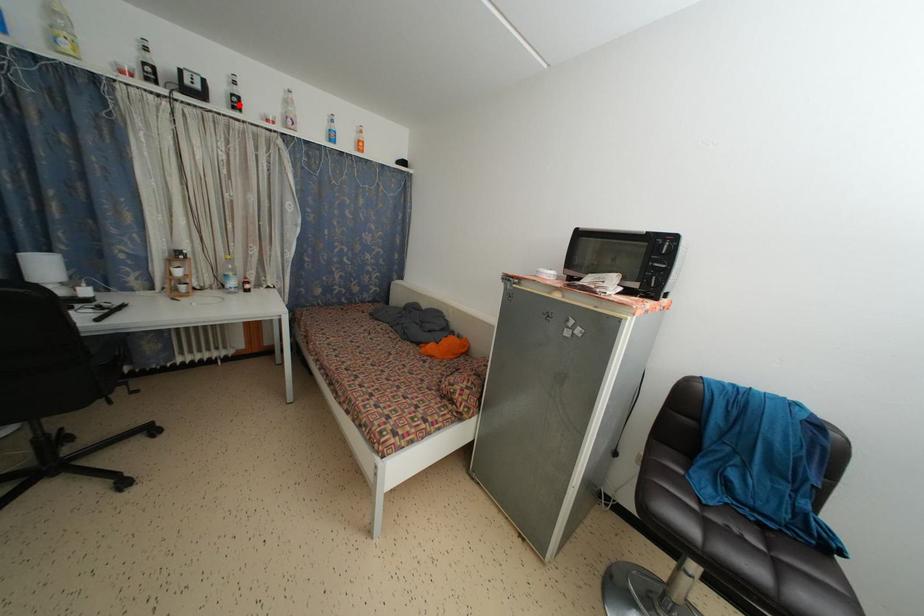
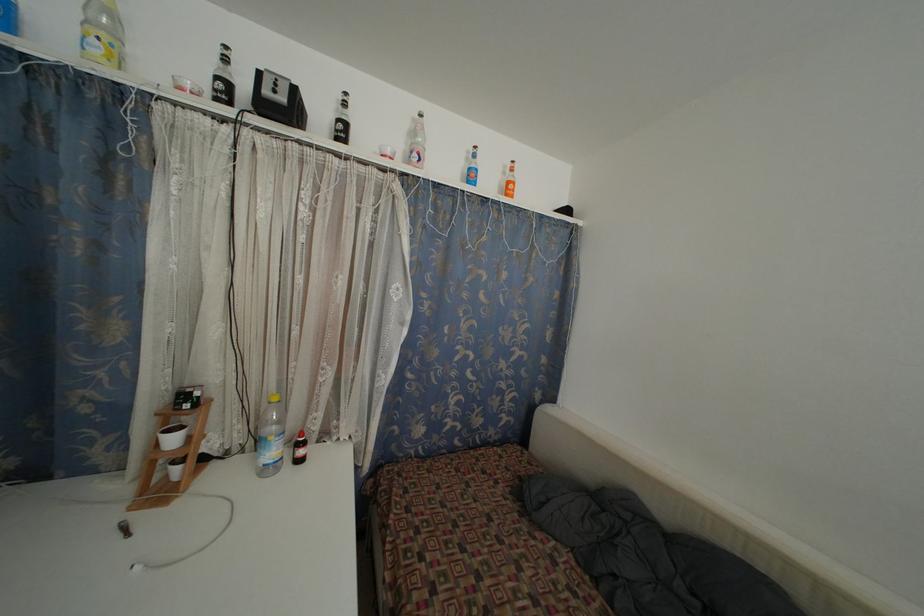
Locate, in the second image, the point that corresponds to the highlighted location in the first image.

(345, 132)